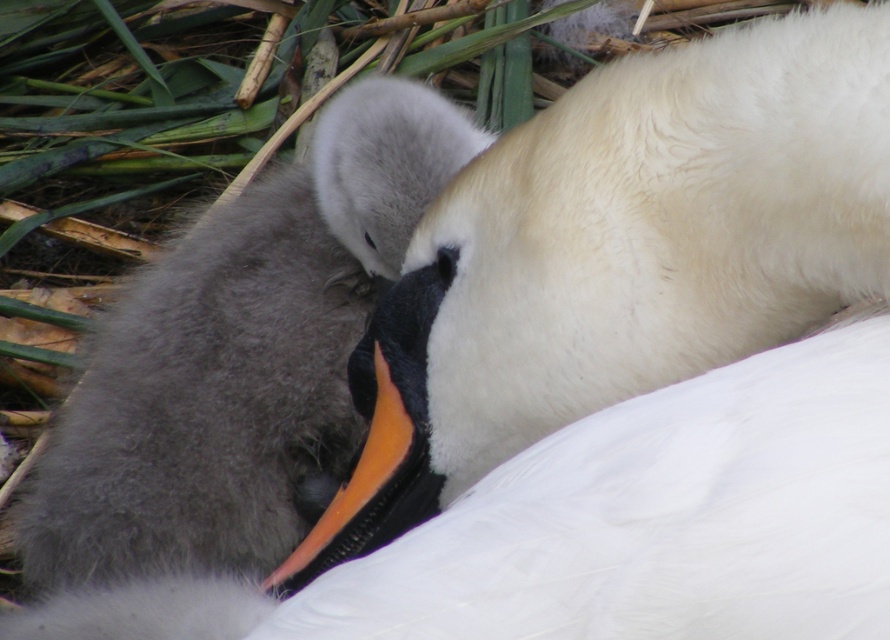
You are a wildlife photographer trying to capture a close shot of the white soft swan at center and the orange glossy beak at center. Based on the scene, which object is wider?

The white soft swan at center is wider than the orange glossy beak at center.

You are standing in a marshy area and want to take a photo of the swans. If you move forward by 2.34 feet, will the point marked at point (260, 460) be closer to you?

The point at point (260, 460) is currently 4.69 feet away. Moving forward by 2.34 feet would reduce the distance to approximately 2.35 feet. Yes, the point would be closer to you after moving forward.

You are a wildlife photographer aiming to capture the white soft swan at center and the orange glossy beak at center in a clear photo. Which object should you focus on first to ensure both are in focus?

The white soft swan at center is in front of the orange glossy beak at center. To ensure both are in focus, you should focus on the white soft swan at center first, as it is closer to the camera.